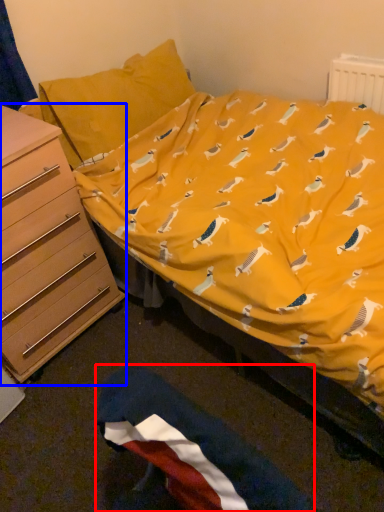
Question: Which of the following is the farthest to the observer, flag (highlighted by a red box) or chest of drawers (highlighted by a blue box)?

Choices:
 (A) flag
 (B) chest of drawers

Answer: (B)